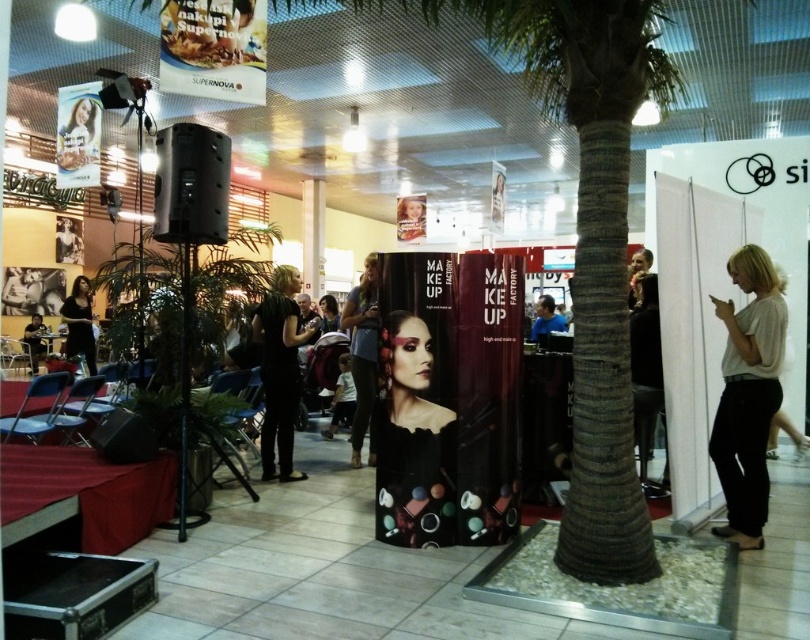
Which is behind, point (416, 387) or point (263, 412)?

Point (263, 412)

Measure the distance between point (x=376, y=522) and camera.

Point (x=376, y=522) is 3.71 meters from camera.

Where is `matte black makeup at center`? Image resolution: width=810 pixels, height=640 pixels. matte black makeup at center is located at coordinates tap(412, 442).

Can you confirm if matte black makeup at center is positioned to the right of black matte dress at left?

Yes, matte black makeup at center is to the right of black matte dress at left.

Does point (433, 515) come closer to viewer compared to point (67, 353)?

Yes.

I want to click on matte black makeup at center, so click(x=412, y=442).

Which is above, white matte shirt at right or matte black dress at center?

matte black dress at center is higher up.

Does white matte shirt at right have a smaller size compared to matte black dress at center?

Yes, white matte shirt at right is smaller than matte black dress at center.

Is point (738, 269) positioned in front of point (357, 401)?

Yes, point (738, 269) is closer to viewer.

You are a GUI agent. You are given a task and a screenshot of the screen. Output one action in this format:
    pyautogui.click(x=<x>, y=<y>)
    Task: Click on the white matte shirt at right
    The image size is (810, 640).
    Given the screenshot: What is the action you would take?
    pyautogui.click(x=748, y=394)